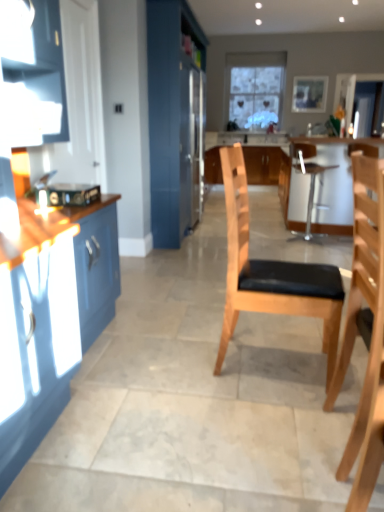
Find the location of a particular element. This screenshot has height=512, width=384. free space to the left of natural wood chair at center, marked as the first chair in a front-to-back arrangement is located at coordinates (282, 442).